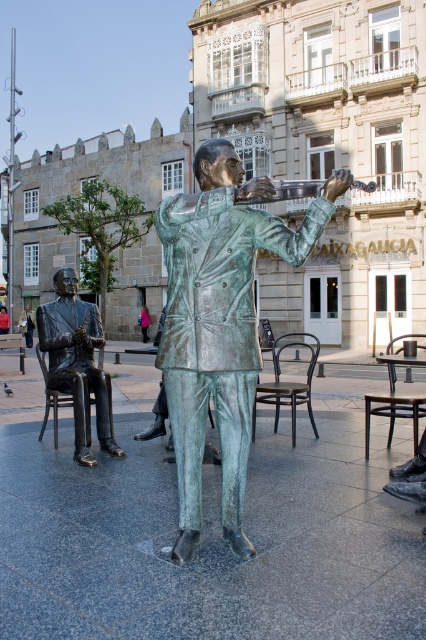
Measure the distance between green patina statue at center and camera.

green patina statue at center is 3.36 meters away from camera.

Who is lower down, green patina statue at center or bronze statue at left?

bronze statue at left

Does point (241, 173) lie in front of point (49, 356)?

Yes, it is.

Where is `green patina statue at center`? The height and width of the screenshot is (640, 426). green patina statue at center is located at coordinates (219, 321).